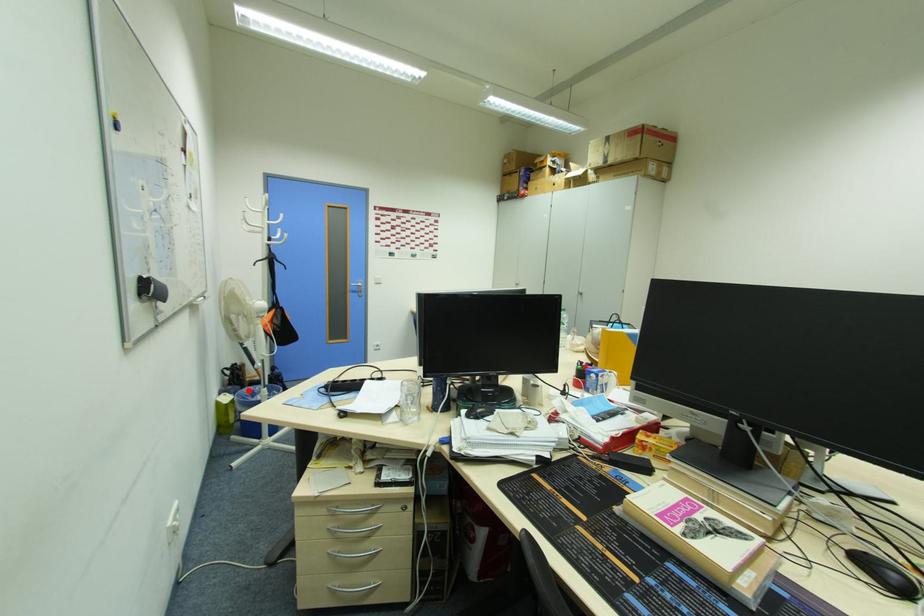
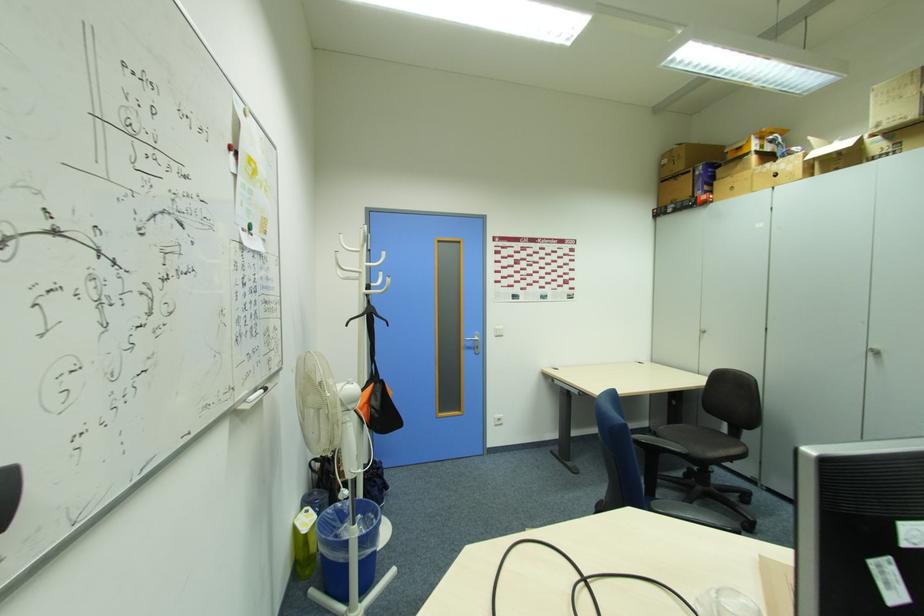
Question: I am providing you with two images of the same scene from different viewpoints. Given a red point in image1, look at the same physical point in image2. Is it:

Choices:
 (A) Closer to the viewpoint
 (B) Farther from the viewpoint

Answer: (B)